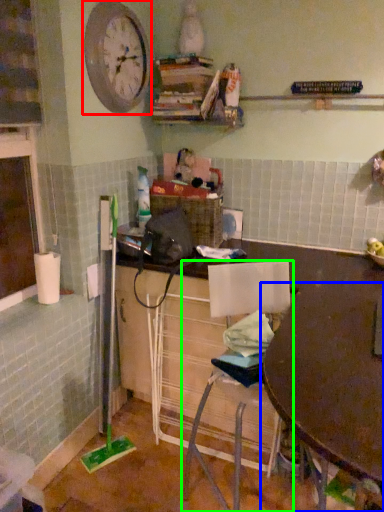
Question: Which is nearer to the clock (highlighted by a red box)? table (highlighted by a blue box) or chair (highlighted by a green box).

Choices:
 (A) table
 (B) chair

Answer: (B)